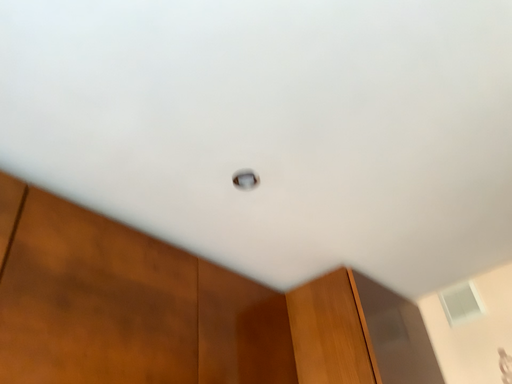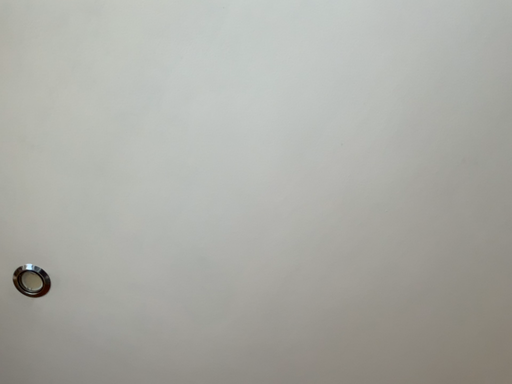
Question: Which way did the camera rotate in the video?

Choices:
 (A) rotated upward
 (B) rotated downward

Answer: (A)